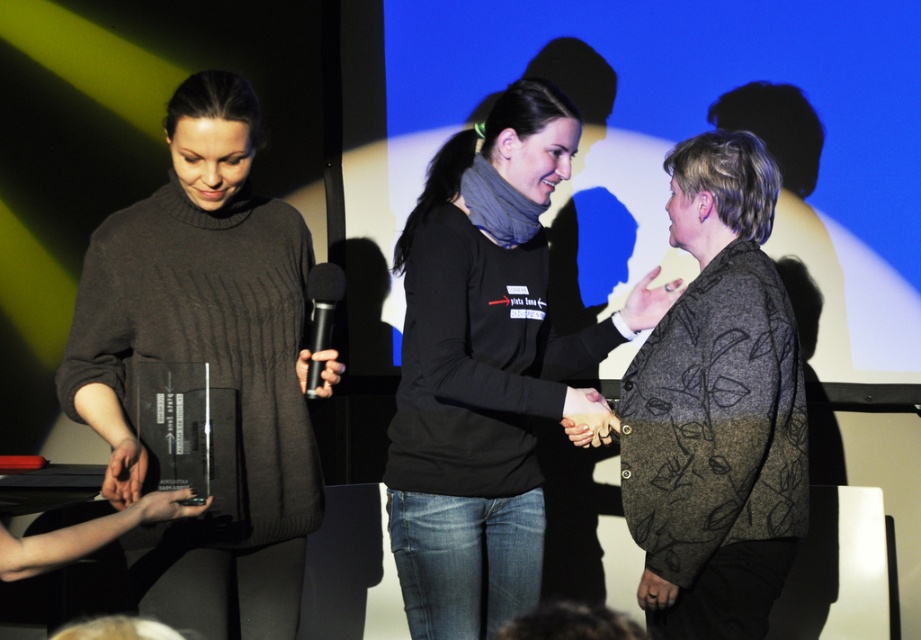
You are a photographer at the event and want to capture a photo where both the knitted dark gray sweater at center and the black matte microphone at center are visible. Based on their positions, which object should be placed on the left side of the photo frame?

The knitted dark gray sweater at center should be placed on the left side of the photo frame since it is positioned to the left of the black matte microphone at center in the scene.

You are an event photographer who needs to capture a closeup of the knitted dark gray sweater at center. The camera you are using has a focus point at coordinate point (x=206, y=360). Will this focus point be effective for capturing the knitted dark gray sweater at center?

The point (x=206, y=360) is on the knitted dark gray sweater at center, so yes, the focus point at that coordinate will effectively capture the knitted dark gray sweater at center.